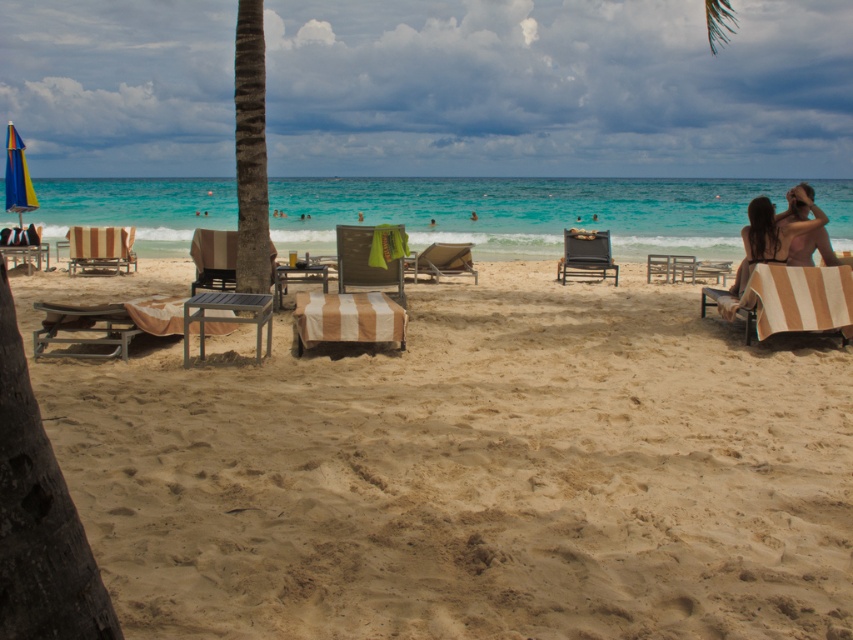
Based on the photo, you are standing at the edge of the ocean looking towards the palm tree trunk in the middle left. Which direction should you walk to reach the beige sandy beach at center located at point (x=471, y=472)?

You should walk towards the palm tree trunk in the middle left because the beige sandy beach at center is located at point (x=471, y=472), which is in the direction of the palm tree trunk.

You are a photographer setting up equipment on the beach. You need to choose between the beige striped lounge chair at right and the striped fabric beach chair at center for placing your camera. Considering their heights, which chair would allow your camera to have a better view of the ocean horizon?

The beige striped lounge chair at right has a greater height compared to the striped fabric beach chair at center, so placing the camera on the beige striped lounge chair at right would provide a better view of the ocean horizon due to its higher elevation.

Where is the beige sandy beach at center located in the image?

The beige sandy beach at center is located at point (471,472).